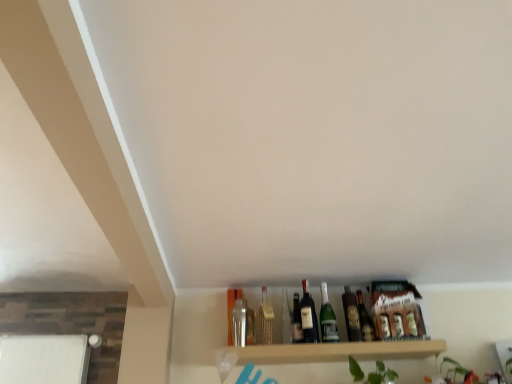
Question: Considering the positions of shiny dark glass bottle at center, which is counted as the first bottle, starting from the right, and matte glass beer bottle at center, acting as the first beer bottle starting from the left, in the image, is shiny dark glass bottle at center, which is counted as the first bottle, starting from the right, wider or thinner than matte glass beer bottle at center, acting as the first beer bottle starting from the left,?

Choices:
 (A) wide
 (B) thin

Answer: (A)

Question: Considering their positions, is shiny dark glass bottle at center, which is counted as the first bottle, starting from the right, located in front of or behind matte glass beer bottle at center, placed as the 2th beer bottle when sorted from right to left?

Choices:
 (A) behind
 (B) front

Answer: (A)

Question: Estimate the real-world distances between objects in this image. Which object is farther from the matte glass beer bottle at center, which is counted as the 2th beer bottle, starting from the left?

Choices:
 (A) shiny dark glass bottle at center, which is counted as the first bottle, starting from the right
 (B) matte glass beer bottle at center, placed as the 2th beer bottle when sorted from right to left
 (C) green glass bottle at center, which ranks as the second bottle in right-to-left order
 (D) clear glass wine bottle at center
 (E) metallic silver bottle at center, which appears as the fourth bottle when viewed from the right

Answer: (E)

Question: Based on their relative distances, which object is nearer to the matte glass bottle at center, which ranks as the second bottle in left-to-right order?

Choices:
 (A) matte glass beer bottle at center, acting as the first beer bottle starting from the left
 (B) shiny dark glass bottle at center, the 4th bottle positioned from the left
 (C) wooden shelf at lower center
 (D) metallic silver bottle at center, which appears as the fourth bottle when viewed from the right
 (E) matte glass beer bottle at center, which is counted as the 2th beer bottle, starting from the left

Answer: (A)